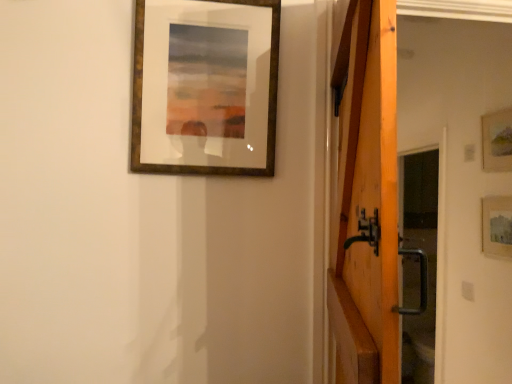
Question: From a real-world perspective, is wooden barn door at right above or below wooden picture frame at upper right, arranged as the 1th picture frame when viewed from the right?

Choices:
 (A) above
 (B) below

Answer: (B)

Question: From the image's perspective, is wooden barn door at right positioned above or below wooden picture frame at upper right, which ranks as the 3th picture frame in left-to-right order?

Choices:
 (A) below
 (B) above

Answer: (A)

Question: Based on their relative distances, which object is nearer to the wooden picture frame at upper right, arranged as the 1th picture frame when viewed from the right?

Choices:
 (A) matte wooden picture frame at right, arranged as the 3th picture frame when viewed from the front
 (B) wooden barn door at right
 (C) wooden frame at upper center, which is the third picture frame in back-to-front order

Answer: (A)

Question: Which is farther from the matte wooden picture frame at right, acting as the first picture frame starting from the back?

Choices:
 (A) wooden frame at upper center, which is the first picture frame in front-to-back order
 (B) wooden picture frame at upper right, which ranks as the second picture frame in back-to-front order
 (C) wooden barn door at right

Answer: (A)